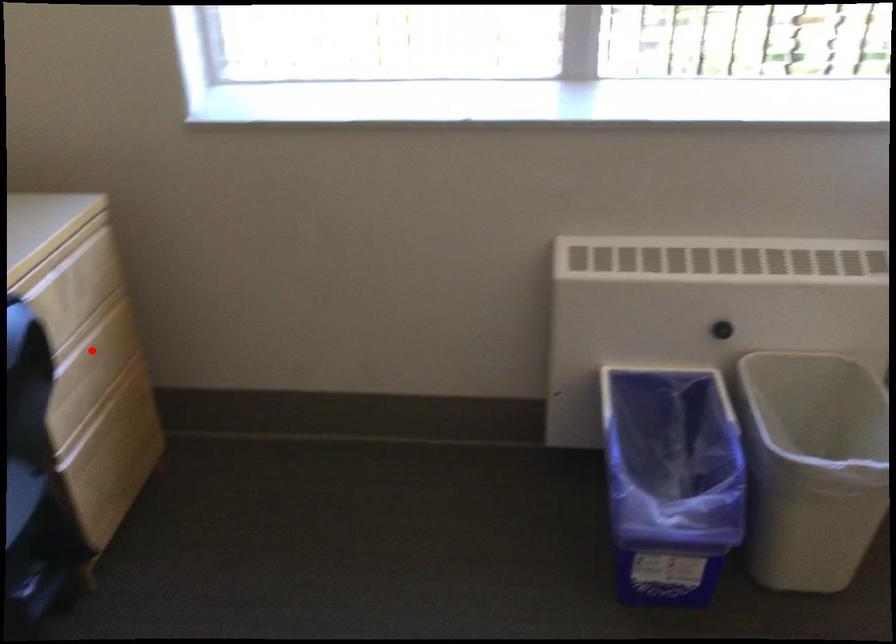
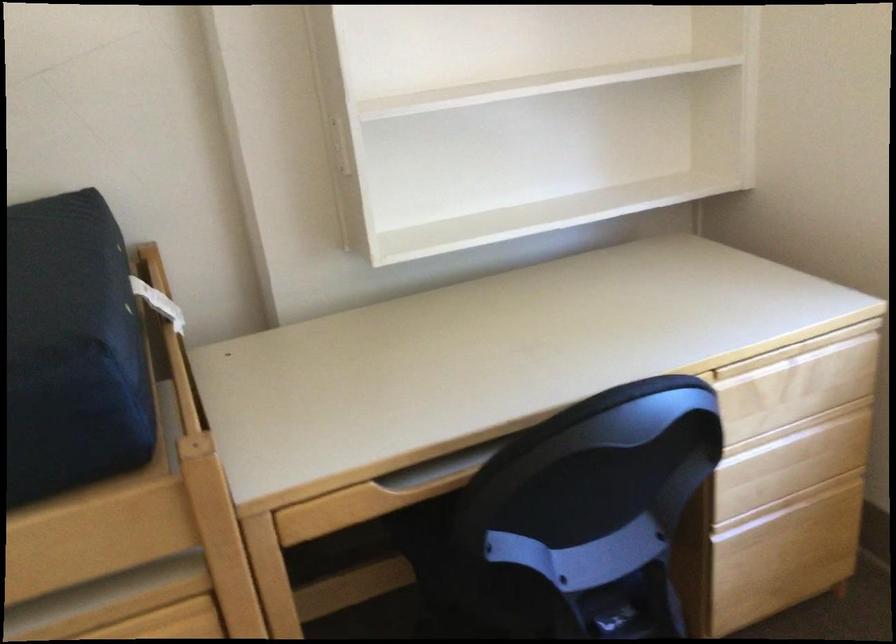
Locate, in the second image, the point that corresponds to the highlighted location in the first image.

(791, 440)